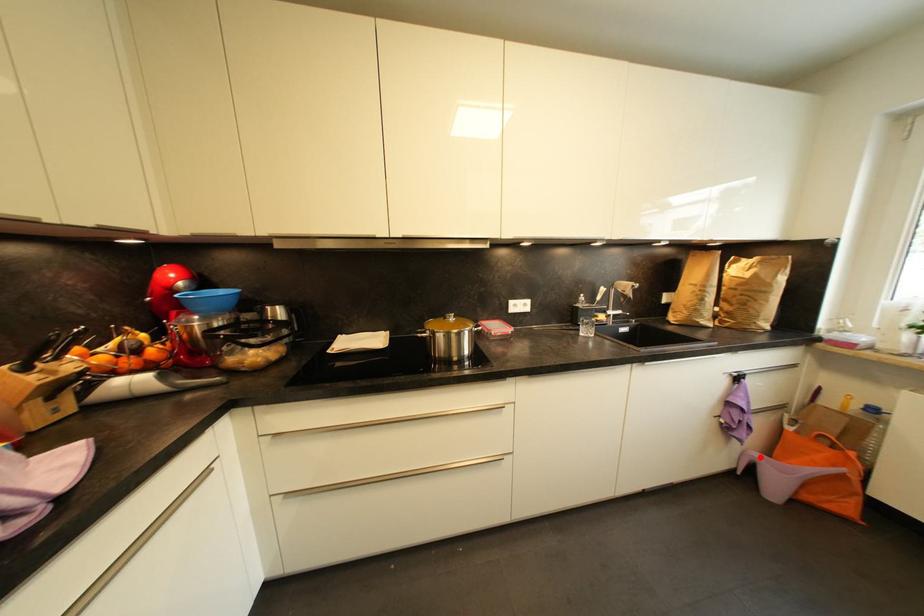
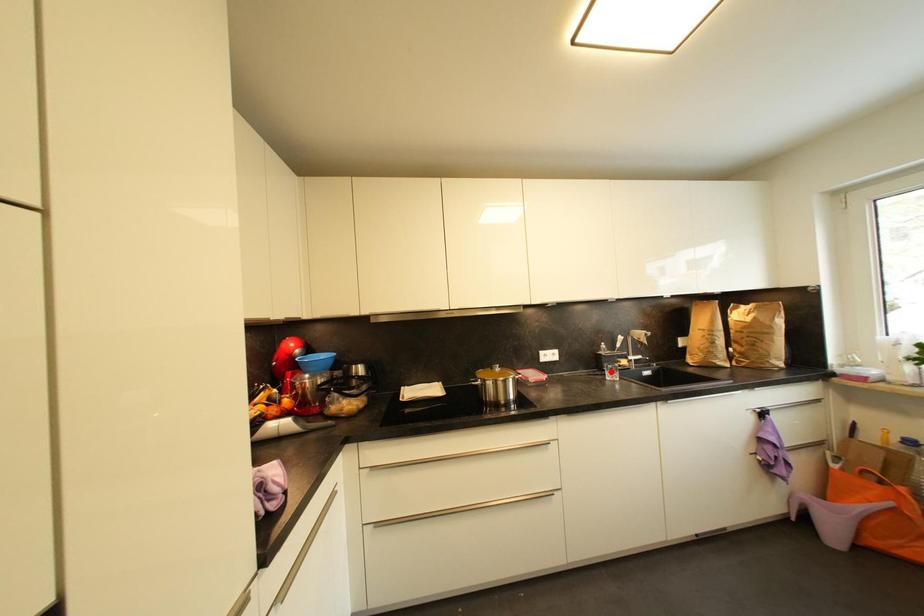
I am providing you with two images of the same scene from different viewpoints. A red point is marked on the first image and another point is marked on the second image. Is the red point in image1 aligned with the point shown in image2?

No